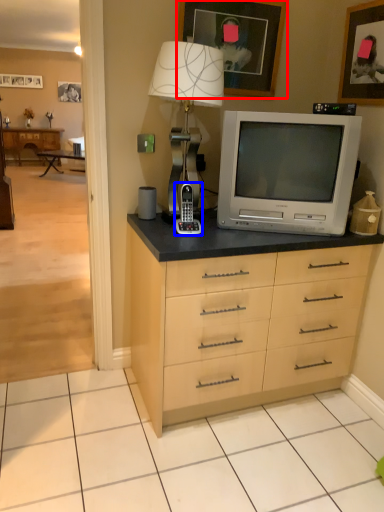
Question: Among these objects, which one is nearest to the camera, picture frame (highlighted by a red box) or appliance (highlighted by a blue box)?

Choices:
 (A) picture frame
 (B) appliance

Answer: (B)